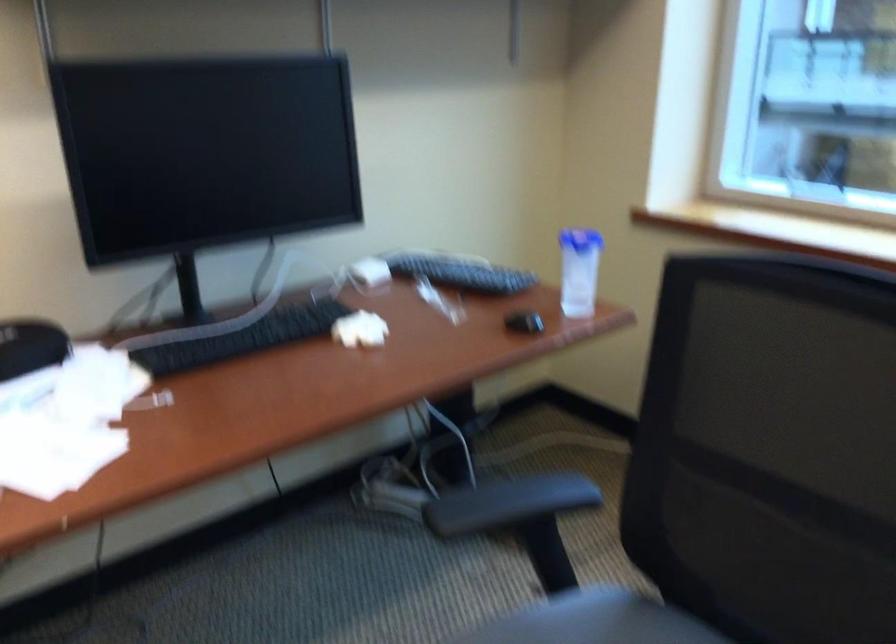
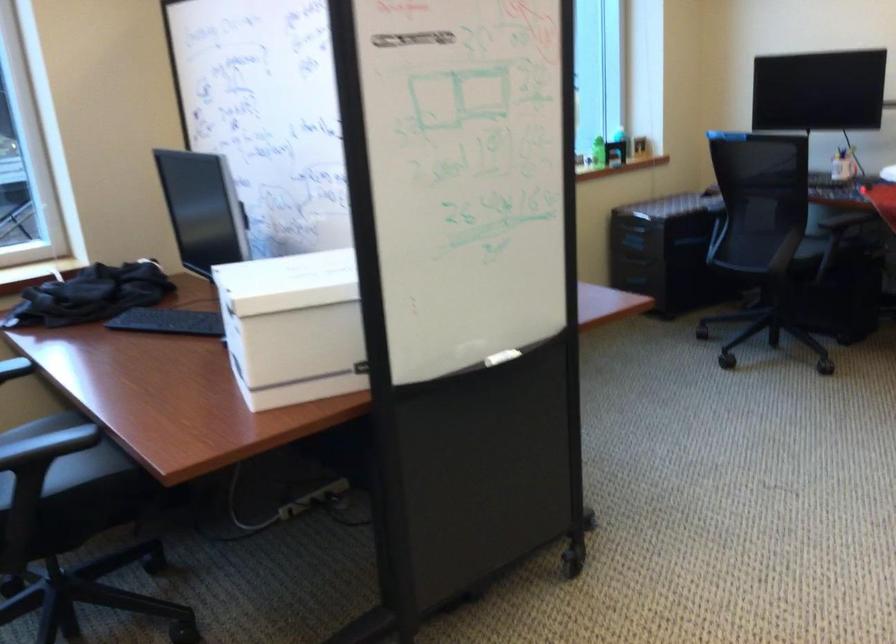
Question: Based on the continuous images, in which direction is the camera rotating? Reply with the corresponding letter.

Choices:
 (A) Left
 (B) Right
 (C) Up
 (D) Down

Answer: (B)